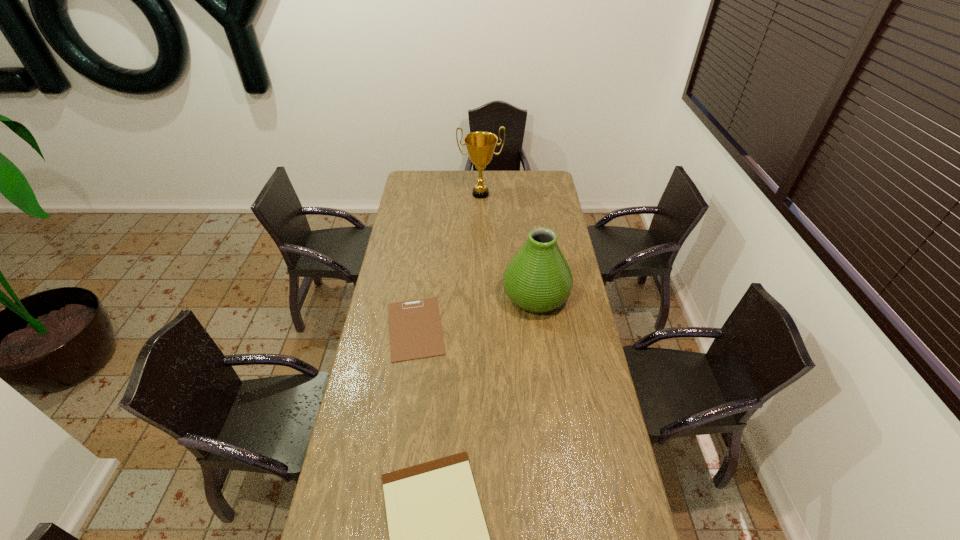
Locate which object is the second closest to the nearer clipboard. Please provide its 2D coordinates. Your answer should be formatted as a tuple, i.e. [(x, y)], where the tuple contains the x and y coordinates of a point satisfying the conditions above.

[(538, 279)]

Locate which object ranks second in proximity to the farther clipboard. Please provide its 2D coordinates. Your answer should be formatted as a tuple, i.e. [(x, y)], where the tuple contains the x and y coordinates of a point satisfying the conditions above.

[(438, 536)]

The width and height of the screenshot is (960, 540). What are the coordinates of `free region that satisfies the following two spatial constraints: 1. on the front view with handles of the award; 2. on the right side of the second tallest object` in the screenshot? It's located at (481, 295).